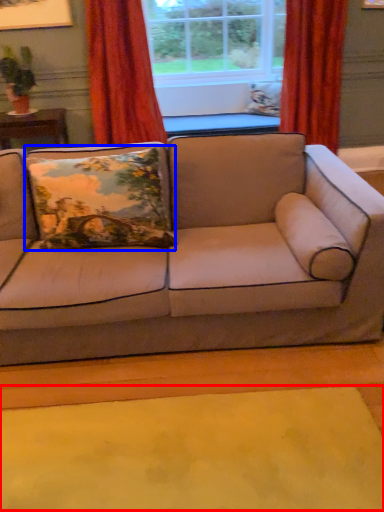
Question: Which object appears closest to the camera in this image, mat (highlighted by a red box) or pillow (highlighted by a blue box)?

Choices:
 (A) mat
 (B) pillow

Answer: (A)